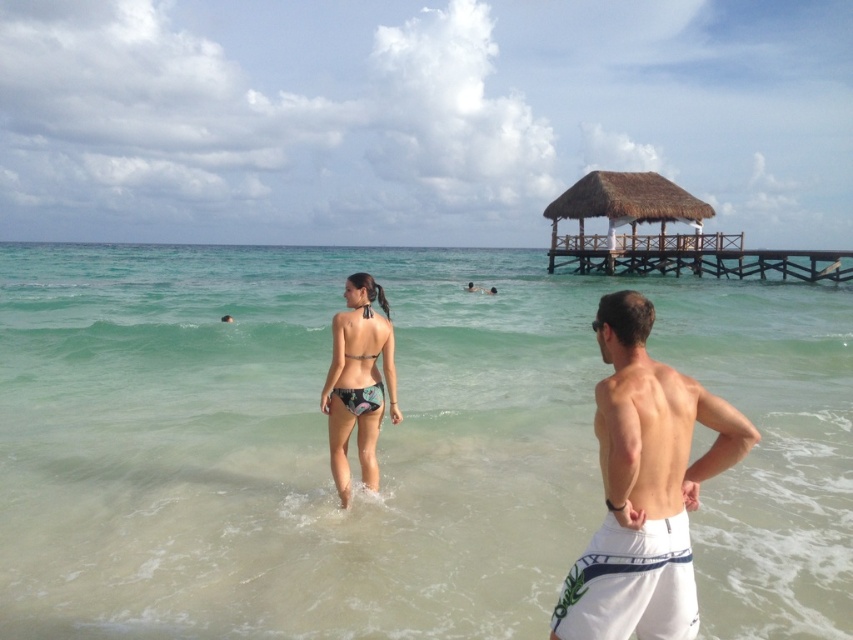
Consider the image. Does printed fabric bikini at center have a lesser width compared to floral print bikini at center?

No, printed fabric bikini at center is not thinner than floral print bikini at center.

Consider the image. Who is positioned more to the left, printed fabric bikini at center or floral print bikini at center?

printed fabric bikini at center

Which is in front, point (374, 481) or point (360, 412)?

Point (360, 412) is more forward.

Locate an element on the screen. The height and width of the screenshot is (640, 853). printed fabric bikini at center is located at coordinates (358, 381).

Who is shorter, printed fabric bikini at center or thatched wood hut at upper center?

printed fabric bikini at center

Is point (337, 360) farther from camera compared to point (666, 216)?

No, (337, 360) is in front of (666, 216).

Identify the location of printed fabric bikini at center. (358, 381).

Is point (12, 385) positioned behind point (581, 193)?

No, (12, 385) is closer to viewer.

Which of these two, clear water at center or thatched wood hut at upper center, stands shorter?

With less height is thatched wood hut at upper center.

What do you see at coordinates (386, 445) in the screenshot? I see `clear water at center` at bounding box center [386, 445].

The width and height of the screenshot is (853, 640). I want to click on clear water at center, so click(386, 445).